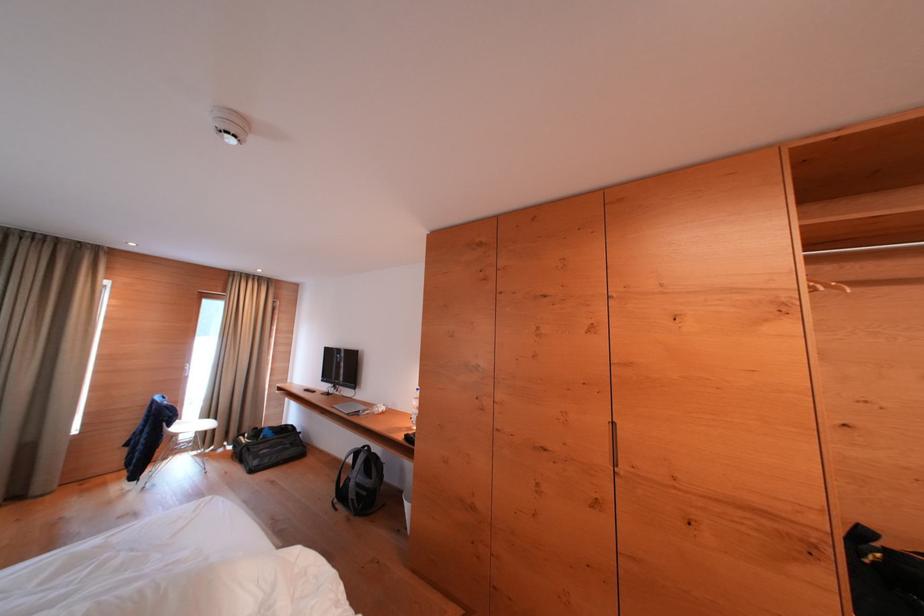
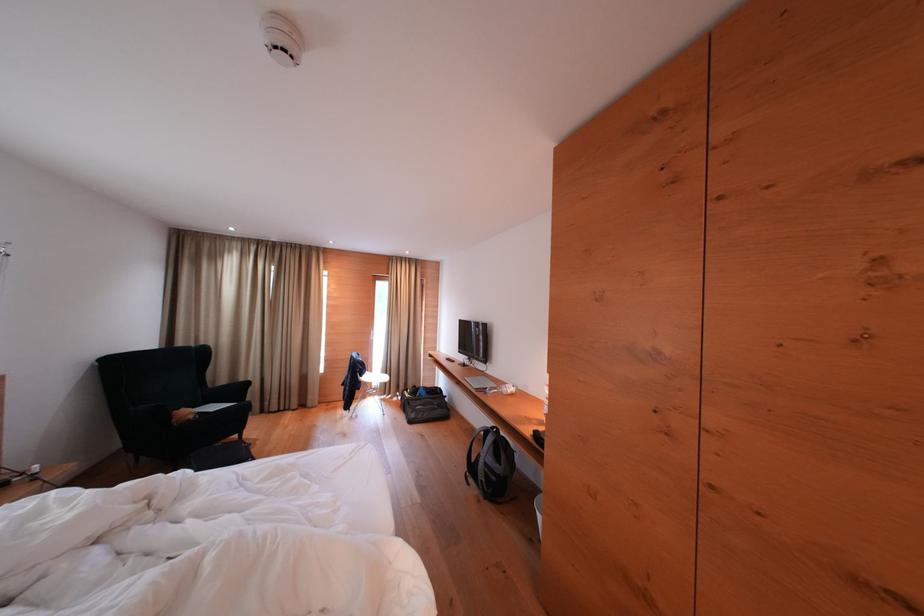
Find the pixel in the second image that matches (363,458) in the first image.

(493, 437)